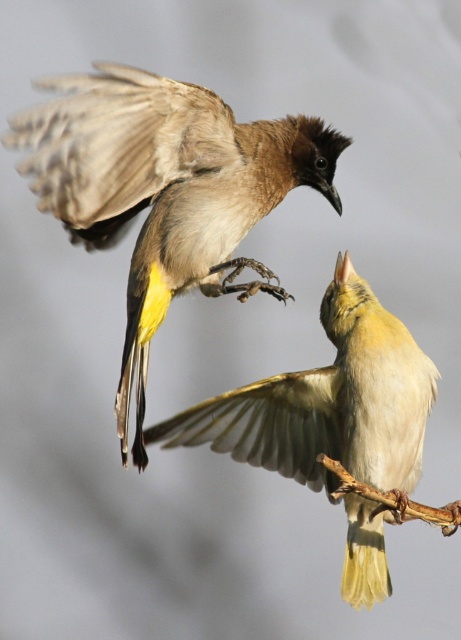
Can you confirm if light brown feathered bird at center is taller than brown wood at lower right?

Yes.

Does light brown feathered bird at center appear over brown wood at lower right?

Indeed, light brown feathered bird at center is positioned over brown wood at lower right.

Who is more forward, (386,328) or (425,516)?

Point (425,516) is more forward.

This screenshot has width=461, height=640. Identify the location of light brown feathered bird at center. (332, 422).

Does light brown feathered bird at center have a greater width compared to brown feathered wing at upper left?

Yes.

Does light brown feathered bird at center appear under brown feathered wing at upper left?

Yes, light brown feathered bird at center is below brown feathered wing at upper left.

Is point (153, 438) positioned before point (102, 243)?

That is True.

The width and height of the screenshot is (461, 640). I want to click on light brown feathered bird at center, so click(332, 422).

At what (x,y) coordinates should I click in order to perform the action: click on brown feathered bird at upper center. Please return your answer as a coordinate pair (x, y). Looking at the image, I should click on [x=165, y=189].